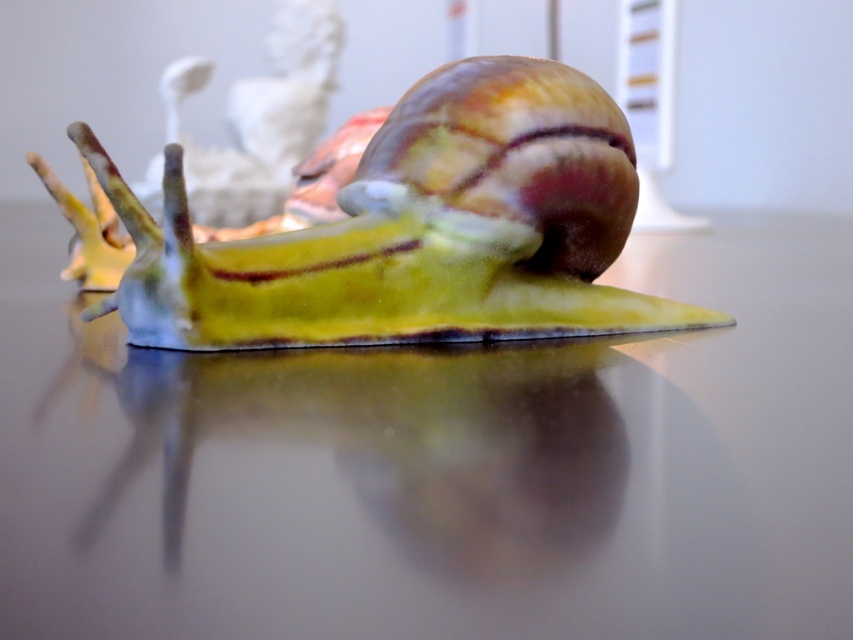
Question: Can you confirm if glossy glass table at center is wider than shiny green snail at center?

Choices:
 (A) no
 (B) yes

Answer: (B)

Question: Which point appears farthest from the camera in this image?

Choices:
 (A) (567, 128)
 (B) (630, 394)

Answer: (A)

Question: Is the position of glossy glass table at center more distant than that of shiny green snail at center?

Choices:
 (A) no
 (B) yes

Answer: (A)

Question: Is glossy glass table at center thinner than shiny green snail at center?

Choices:
 (A) no
 (B) yes

Answer: (A)